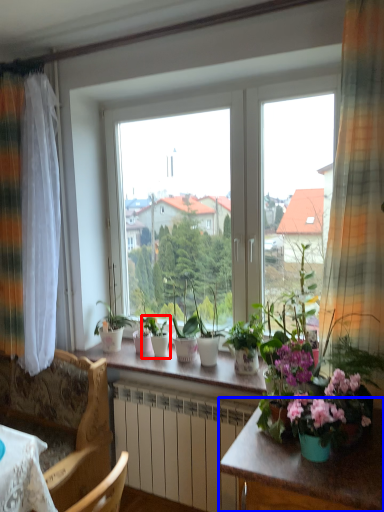
Question: Which of the following is the closest to the observer, houseplant (highlighted by a red box) or table (highlighted by a blue box)?

Choices:
 (A) houseplant
 (B) table

Answer: (B)